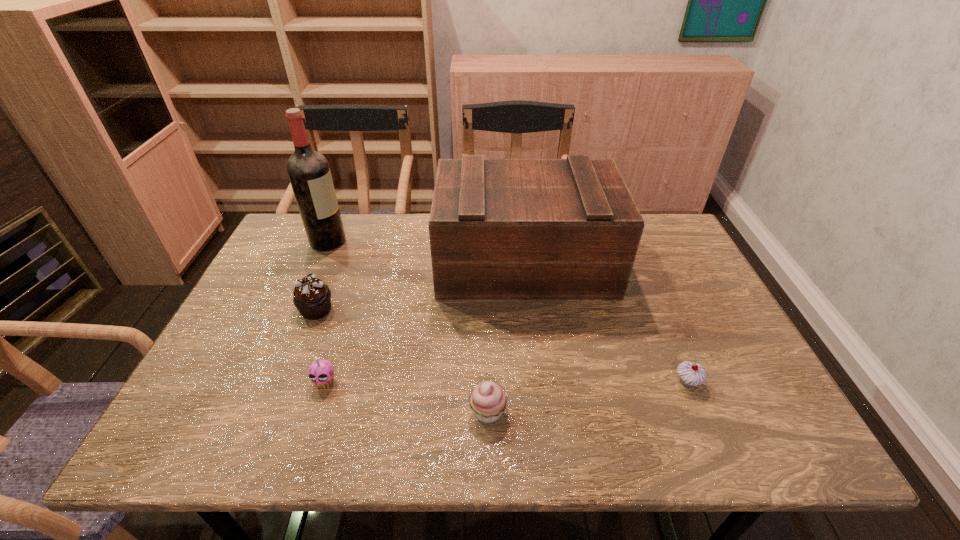
Identify the location of vacant space in between the leftmost cupcake and the second cupcake from right to left. The image size is (960, 540). (402, 361).

Locate an element on the screen. The image size is (960, 540). free spot between the tallest object and the leftmost cupcake is located at coordinates (323, 275).

The image size is (960, 540). Identify the location of free space between the rightmost cupcake and the third object from left to right. (506, 382).

This screenshot has height=540, width=960. In order to click on free space between the rightmost object and the third object from left to right in this screenshot , I will do `click(506, 382)`.

Locate an element on the screen. free spot between the box and the third cupcake from left to right is located at coordinates (506, 337).

At what (x,y) coordinates should I click in order to perform the action: click on the third closest object to the fourth object from right to left. Please return your answer as a coordinate pair (x, y). Looking at the image, I should click on (500, 229).

Identify the location of the fifth closest object to the rightmost cupcake. This screenshot has height=540, width=960. (308, 170).

This screenshot has height=540, width=960. I want to click on the third closest cupcake to the rightmost object, so click(x=312, y=298).

Identify which cupcake is the nearest to the third object from left to right. Please provide its 2D coordinates. Your answer should be formatted as a tuple, i.e. [(x, y)], where the tuple contains the x and y coordinates of a point satisfying the conditions above.

[(312, 298)]

Where is `vacant point that satisfies the following two spatial constraints: 1. on the front-facing side of the liquor; 2. on the back side of the third cupcake from left to right`? This screenshot has height=540, width=960. vacant point that satisfies the following two spatial constraints: 1. on the front-facing side of the liquor; 2. on the back side of the third cupcake from left to right is located at coordinates (254, 412).